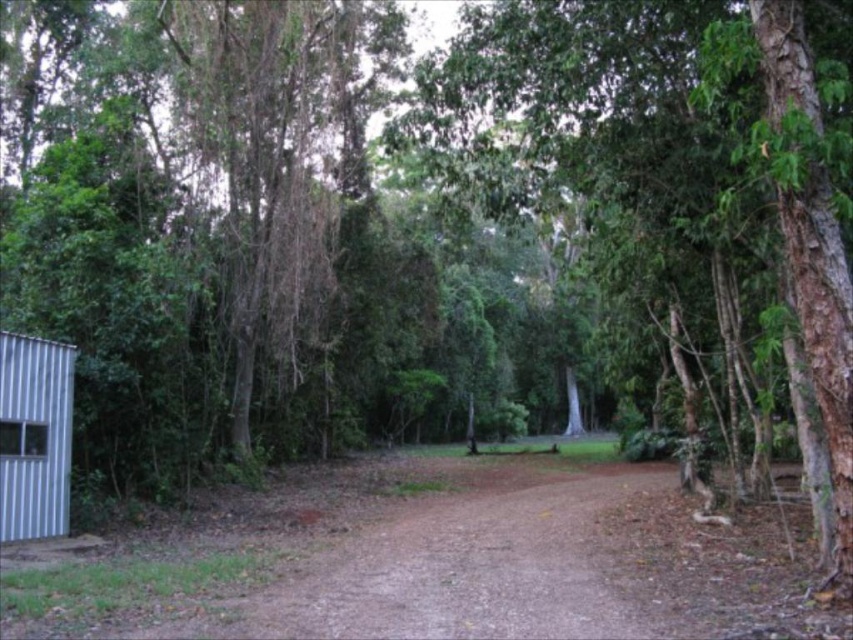
Does green leafy tree at center appear under silver corrugated hut at left?

No, green leafy tree at center is not below silver corrugated hut at left.

Consider the image. Is green leafy tree at center positioned in front of silver corrugated hut at left?

Yes.

Identify the location of green leafy tree at center. This screenshot has width=853, height=640. (660, 170).